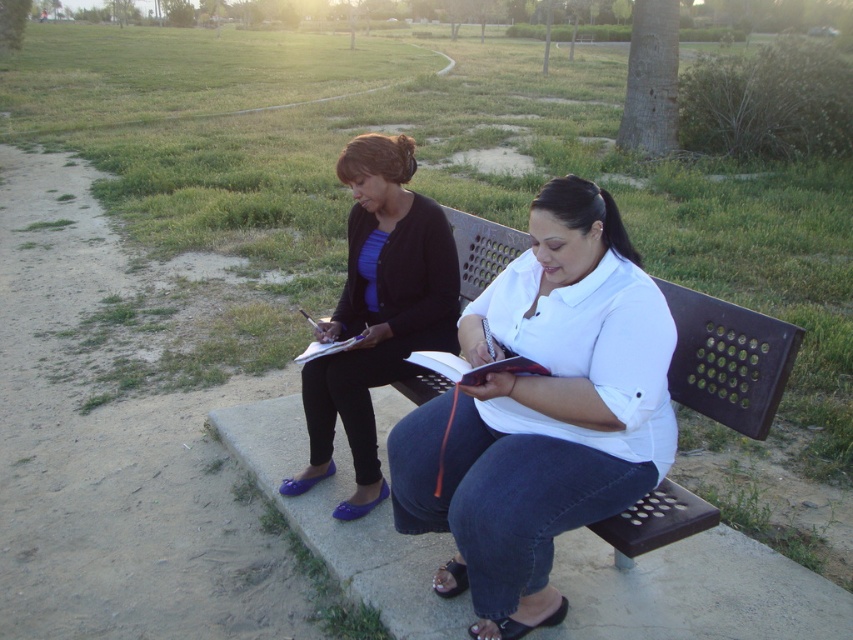
Can you confirm if white matte shirt at center is thinner than red leather journal at center?

Incorrect, white matte shirt at center's width is not less than red leather journal at center's.

Is point (555, 470) positioned behind point (450, 360)?

No, it is not.

Locate an element on the screen. white matte shirt at center is located at coordinates (543, 412).

What do you see at coordinates (543, 412) in the screenshot? The width and height of the screenshot is (853, 640). I see `white matte shirt at center` at bounding box center [543, 412].

Does point (555, 396) come in front of point (454, 312)?

Yes, it is.

The width and height of the screenshot is (853, 640). I want to click on white matte shirt at center, so click(x=543, y=412).

Who is more forward, (453, 339) or (440, 371)?

Positioned in front is point (440, 371).

Does matte black sweater at upper left come in front of red leather journal at center?

No, matte black sweater at upper left is further to the viewer.

Which is in front, point (343, 179) or point (461, 376)?

Point (461, 376)

The height and width of the screenshot is (640, 853). I want to click on matte black sweater at upper left, so click(x=376, y=310).